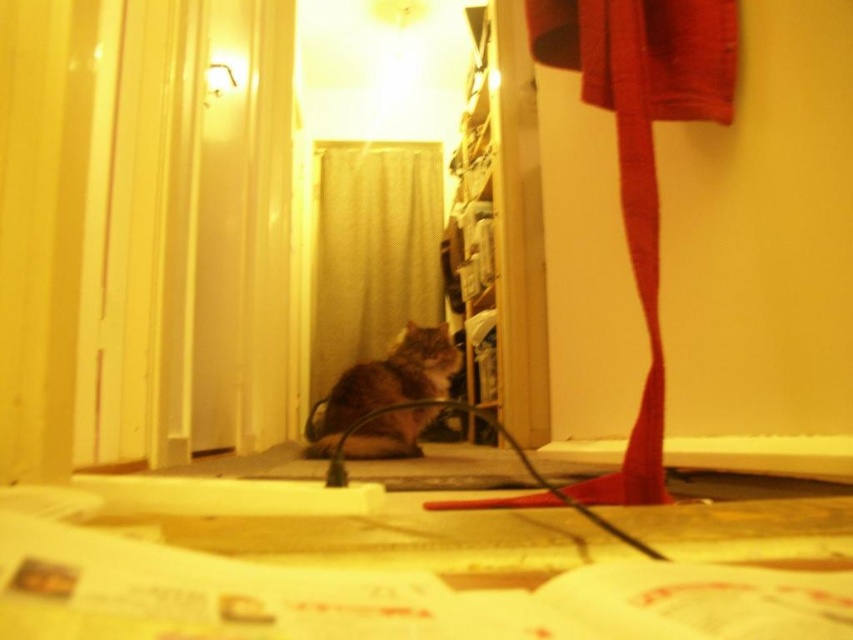
You are a delivery person who needs to place a package on the white textured curtain at center without disturbing the tabby fur cat at center. Given that the package requires 3 feet of space, can you safely place it there?

The distance between the white textured curtain at center and the tabby fur cat at center is 8.80 feet. Since the package needs 3 feet of space, there is enough distance to place it safely without disturbing the cat.

You are standing in the room and want to see what is behind the white textured curtain at center. The tabby fur cat at center is blocking your view. Can you move around the cat to see behind the curtain?

The white textured curtain at center is to the left of the tabby fur cat at center, so you can move to the right side of the cat to see behind the curtain.

You are trying to decide whether to hang a new coat rack on the wall behind the tabby fur cat at center. The coat rack requires 2 feet of space. Can the white textured curtain at center provide enough space for the coat rack?

The white textured curtain at center has a larger width than the tabby fur cat at center, so it can provide enough space for the coat rack requiring 2 feet.